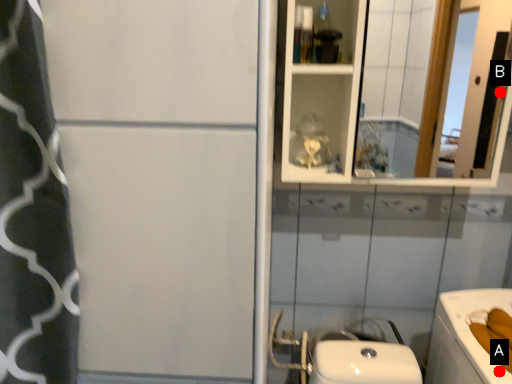
Question: Two points are circled on the image, labeled by A and B beside each circle. Which point is further to the camera?

Choices:
 (A) A is further
 (B) B is further

Answer: (B)